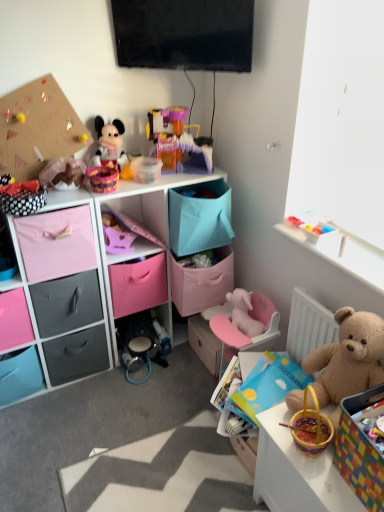
This screenshot has height=512, width=384. Identify the location of vacant area that is in front of matte black drawer at lower left, the 4th drawer in the left-to-right sequence. (69, 409).